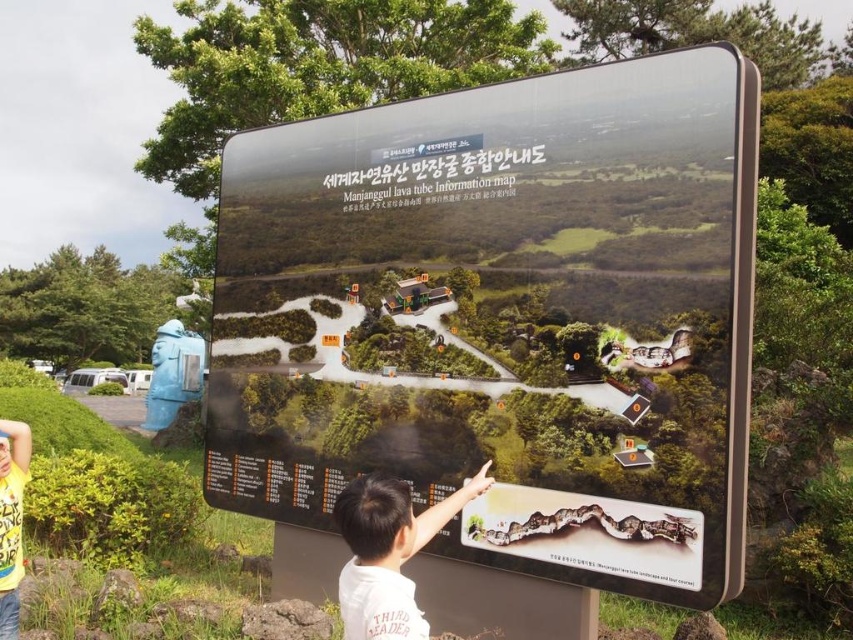
Between glossy plastic billboard at center and white cotton shirt at center, which one is positioned lower?

Positioned lower is white cotton shirt at center.

Does glossy plastic billboard at center have a lesser height compared to white cotton shirt at center?

No, glossy plastic billboard at center is not shorter than white cotton shirt at center.

Is point (299, 301) closer to viewer compared to point (384, 605)?

No, (299, 301) is behind (384, 605).

Image resolution: width=853 pixels, height=640 pixels. Find the location of `glossy plastic billboard at center`. glossy plastic billboard at center is located at coordinates (503, 317).

Between point (370, 504) and point (7, 488), which one is positioned behind?

The point (7, 488) is more distant.

Between white cotton shirt at center and yellow t-shirt at lower left, which one has more height?

yellow t-shirt at lower left is taller.

Is point (351, 536) positioned behind point (10, 579)?

No, (351, 536) is closer to viewer.

Locate an element on the screen. This screenshot has width=853, height=640. white cotton shirt at center is located at coordinates coord(387,552).

Does glossy plastic billboard at center have a lesser height compared to yellow t-shirt at lower left?

No.

Is glossy plastic billboard at center to the left of yellow t-shirt at lower left from the viewer's perspective?

In fact, glossy plastic billboard at center is to the right of yellow t-shirt at lower left.

Does point (596, 76) come farther from viewer compared to point (1, 440)?

Yes, point (596, 76) is farther from viewer.

You are a GUI agent. You are given a task and a screenshot of the screen. Output one action in this format:
    pyautogui.click(x=<x>, y=<y>)
    Task: Click on the glossy plastic billboard at center
    
    Given the screenshot: What is the action you would take?
    (503, 317)